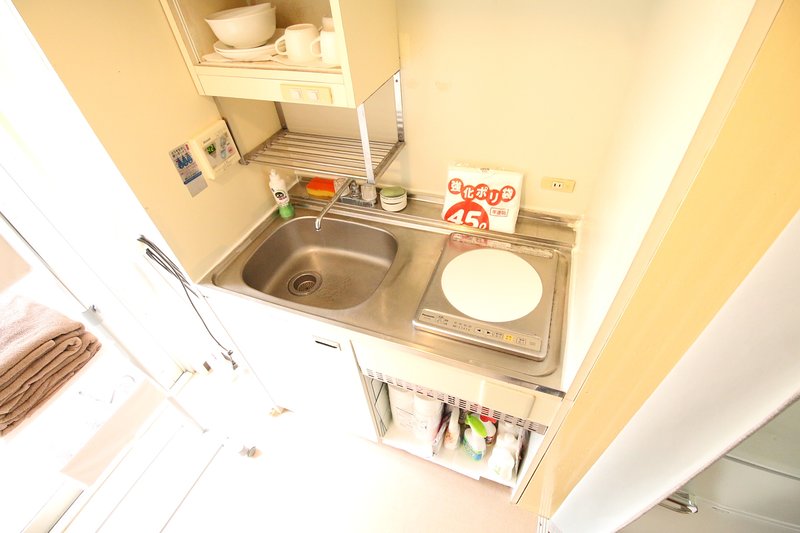
Find the location of `cupboard`. cupboard is located at coordinates (318, 398).